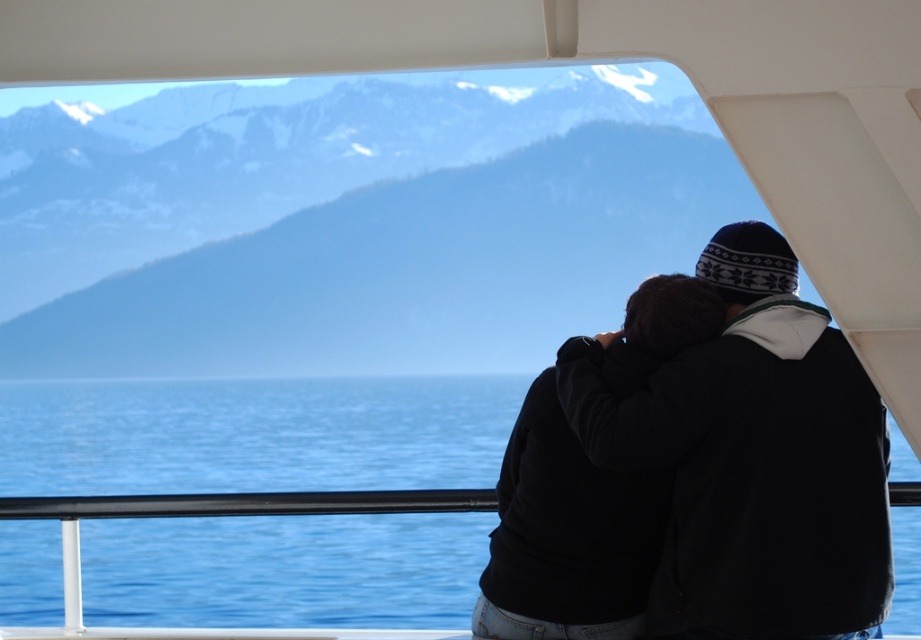
Question: Does blue water at center appear under black fleece jacket at center?

Choices:
 (A) no
 (B) yes

Answer: (B)

Question: Can you confirm if snowy mountain range at upper left is thinner than black fleece jacket at center?

Choices:
 (A) no
 (B) yes

Answer: (A)

Question: Which object is farther from the camera taking this photo?

Choices:
 (A) blue water at center
 (B) black fleece jacket at center

Answer: (A)

Question: Which point appears farthest from the camera in this image?

Choices:
 (A) (533, 280)
 (B) (259, 570)
 (C) (621, 442)

Answer: (A)

Question: Is snowy mountain range at upper left to the right of blue water at center from the viewer's perspective?

Choices:
 (A) yes
 (B) no

Answer: (A)

Question: Which object is farther from the camera taking this photo?

Choices:
 (A) snowy mountain range at upper left
 (B) black fleece jacket at center
 (C) blue water at center

Answer: (C)